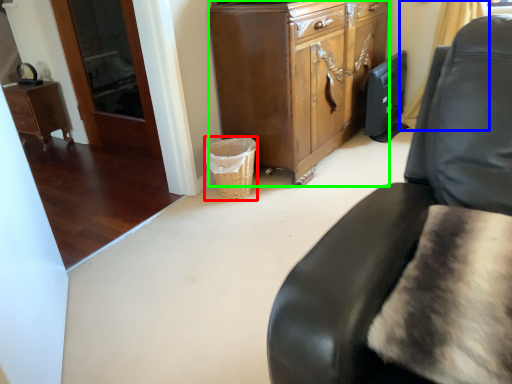
Question: Which object is the farthest from basket (highlighted by a red box)? Choose among these: curtain (highlighted by a blue box) or cabinetry (highlighted by a green box).

Choices:
 (A) curtain
 (B) cabinetry

Answer: (A)